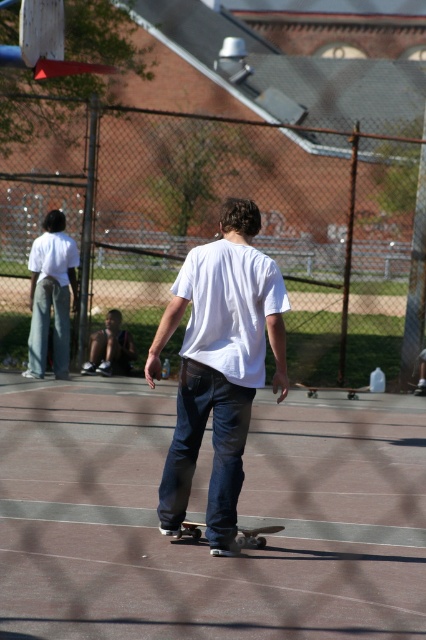
Question: Is metallic chain-link fence at center further to the viewer compared to wooden skateboard at center?

Choices:
 (A) no
 (B) yes

Answer: (B)

Question: Which object is farther from the camera taking this photo?

Choices:
 (A) blue denim shorts at lower left
 (B) smooth concrete skateboard at center

Answer: (A)

Question: Is white cotton shirt at left to the left of wooden skateboard at center from the viewer's perspective?

Choices:
 (A) yes
 (B) no

Answer: (A)

Question: Can you confirm if metallic chain-link fence at center is wider than black matte skateboard at center?

Choices:
 (A) no
 (B) yes

Answer: (A)

Question: Which of the following is the farthest from the observer?

Choices:
 (A) (20, 236)
 (B) (66, 294)
 (C) (305, 388)

Answer: (A)

Question: Among these objects, which one is farthest from the camera?

Choices:
 (A) wooden skateboard at center
 (B) black matte skateboard at center
 (C) smooth concrete skateboard at center
 (D) white matte shirt at center

Answer: (B)